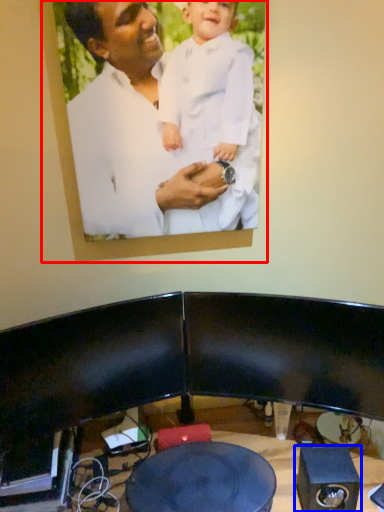
Question: Among these objects, which one is nearest to the camera, picture frame (highlighted by a red box) or speaker (highlighted by a blue box)?

Choices:
 (A) picture frame
 (B) speaker

Answer: (A)